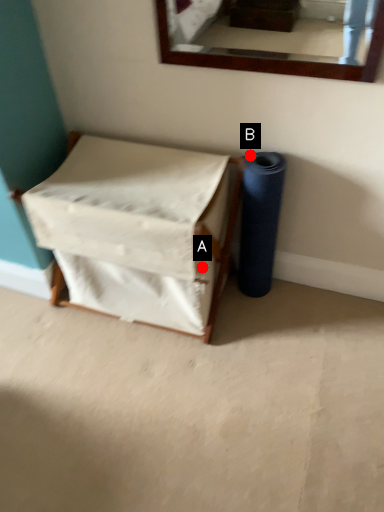
Question: Two points are circled on the image, labeled by A and B beside each circle. Which point is farther to the camera?

Choices:
 (A) A is further
 (B) B is further

Answer: (B)